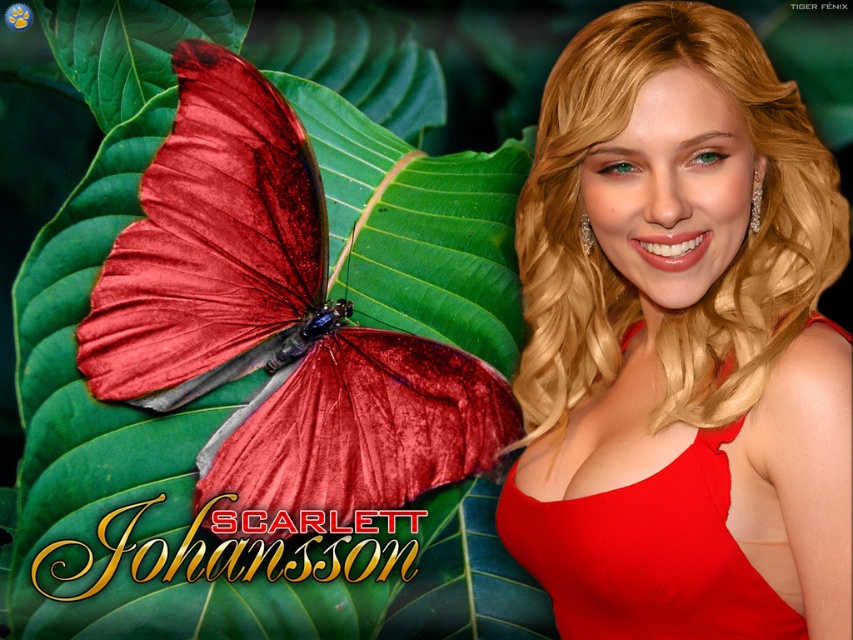
You are an artist analyzing this image. You notice two points marked in the scene. The first point is at coordinates point (306, 371), and the second is at point (663, 488). Based on their positions, which point is closer to the viewer?

Point (663, 488) is closer to the viewer because the description states that point (306, 371) is behind point (663, 488).